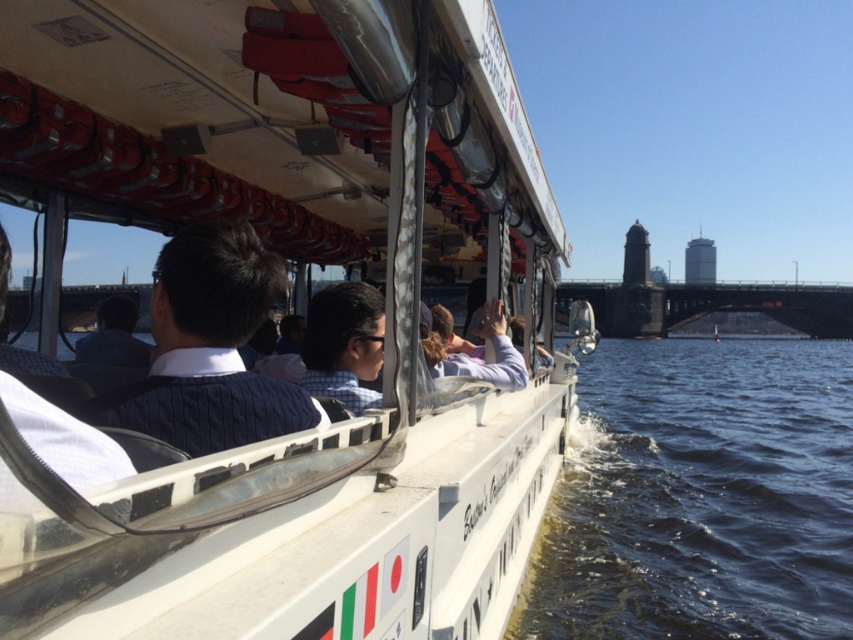
You are a photographer on the boat and want to take a photo of the two people wearing the navy blue sweater at center and checkered fabric shirt at center. Which one is positioned higher in the image?

The navy blue sweater at center is positioned higher in the image as it is above the checkered fabric shirt at center.